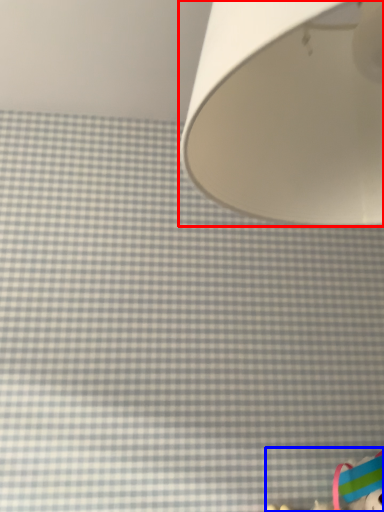
Question: Which point is closer to the camera, lamp (highlighted by a red box) or toy (highlighted by a blue box)?

Choices:
 (A) lamp
 (B) toy

Answer: (A)